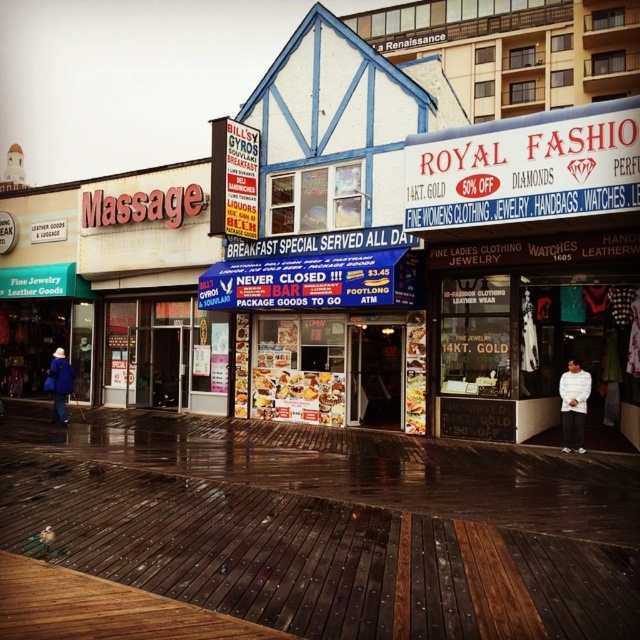
Is white fabric shirt at lower right smaller than blue woolen coat at lower left?

Indeed, white fabric shirt at lower right has a smaller size compared to blue woolen coat at lower left.

Is white fabric shirt at lower right thinner than blue woolen coat at lower left?

Correct, white fabric shirt at lower right's width is less than blue woolen coat at lower left's.

Where is `white fabric shirt at lower right`? The height and width of the screenshot is (640, 640). white fabric shirt at lower right is located at coordinates (573, 404).

The width and height of the screenshot is (640, 640). I want to click on white fabric shirt at lower right, so click(x=573, y=404).

Which is in front, point (276, 410) or point (68, 372)?

Point (68, 372)

From the picture: Who is more distant from viewer, (333, 420) or (45, 376)?

The point (45, 376) is more distant.

Where is `golden crispy fries at center`? The image size is (640, 640). golden crispy fries at center is located at coordinates (298, 396).

The width and height of the screenshot is (640, 640). Find the location of `golden crispy fries at center`. golden crispy fries at center is located at coordinates (298, 396).

Looking at this image, does golden crispy fries at center lie behind white fabric shirt at lower right?

Yes, golden crispy fries at center is behind white fabric shirt at lower right.

What do you see at coordinates (298, 396) in the screenshot? This screenshot has width=640, height=640. I see `golden crispy fries at center` at bounding box center [298, 396].

Does point (280, 380) come closer to viewer compared to point (577, 419)?

That is False.

Locate an element on the screen. golden crispy fries at center is located at coordinates (298, 396).